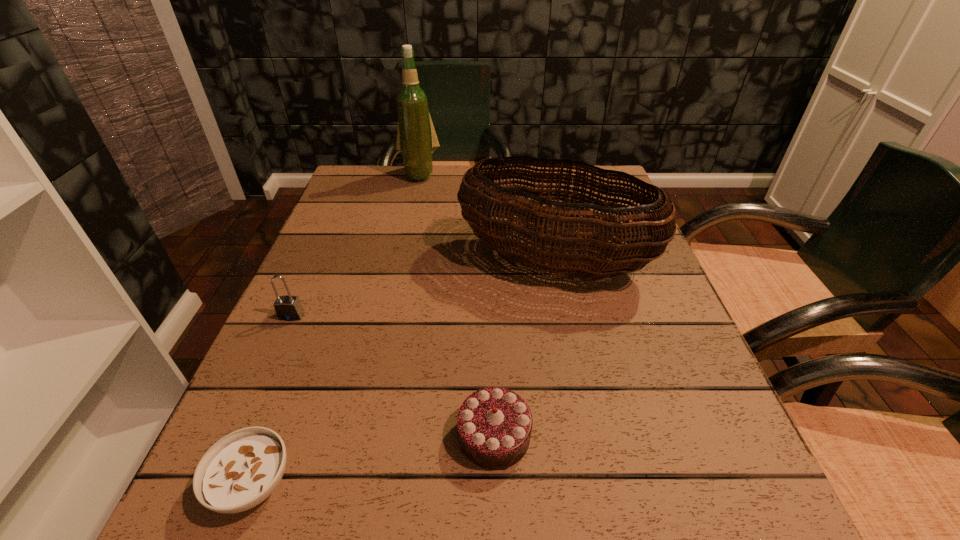
The width and height of the screenshot is (960, 540). In order to click on object that is at the near left corner in this screenshot , I will do (x=242, y=469).

In the image, there is a desktop. Where is `free space at the far edge`? The width and height of the screenshot is (960, 540). free space at the far edge is located at coordinates (405, 183).

The width and height of the screenshot is (960, 540). Find the location of `free space at the near edge of the desktop`. free space at the near edge of the desktop is located at coordinates (489, 507).

The image size is (960, 540). In the image, there is a desktop. Identify the location of vacant space at the left edge. (359, 255).

This screenshot has height=540, width=960. Identify the location of vacant space at the right edge. (650, 451).

This screenshot has width=960, height=540. In the image, there is a desktop. Identify the location of free space at the near right corner. (684, 496).

This screenshot has width=960, height=540. Identify the location of vacant area that lies between the basket and the shortest object. (403, 372).

Where is `free point between the third shortest object and the tallest object`? This screenshot has height=540, width=960. free point between the third shortest object and the tallest object is located at coordinates (355, 245).

Identify the location of free space between the wine bottle and the third nearest object. The width and height of the screenshot is (960, 540). (355, 245).

What are the coordinates of `vacant space that's between the padlock and the wine bottle` in the screenshot? It's located at (355, 245).